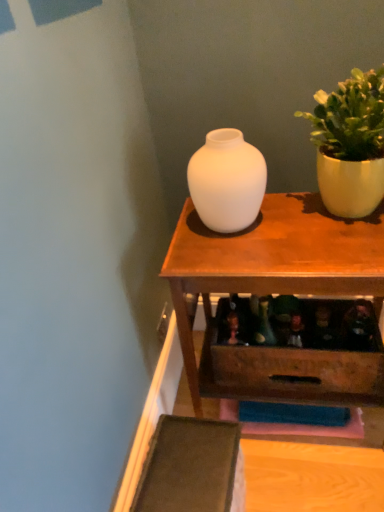
The image size is (384, 512). In order to click on empty space that is to the right of white matte vase at center in this screenshot , I will do `click(287, 222)`.